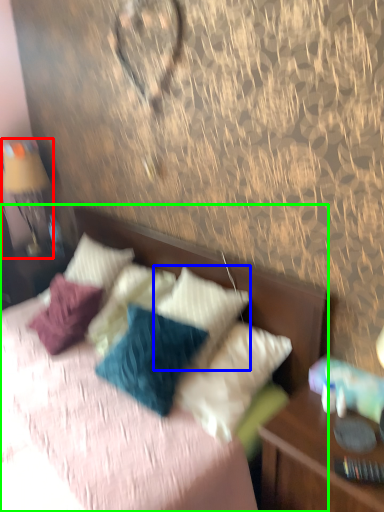
Question: Estimate the real-world distances between objects in this image. Which object is closer to bedside lamp (highlighted by a red box), pillow (highlighted by a blue box) or bed (highlighted by a green box)?

Choices:
 (A) pillow
 (B) bed

Answer: (B)